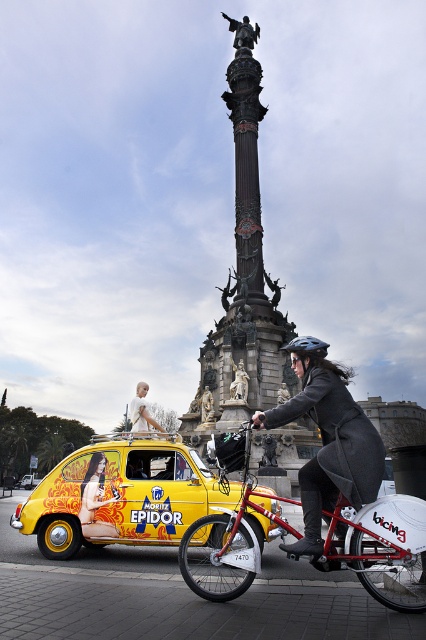
Who is positioned more to the right, dark stone column at center or black matte bicycle helmet at center?

Positioned to the right is black matte bicycle helmet at center.

Measure the distance between dark stone column at center and black matte bicycle helmet at center.

dark stone column at center is 25.63 meters from black matte bicycle helmet at center.

What do you see at coordinates (242, 280) in the screenshot? This screenshot has height=640, width=426. I see `dark stone column at center` at bounding box center [242, 280].

The height and width of the screenshot is (640, 426). Find the location of `dark stone column at center`. dark stone column at center is located at coordinates (242, 280).

Is gray wool coat at center above yellow matte vintage car at center?

Indeed, gray wool coat at center is positioned over yellow matte vintage car at center.

Consider the image. Does gray wool coat at center come behind yellow matte vintage car at center?

No, gray wool coat at center is in front of yellow matte vintage car at center.

Measure the distance between point (305, 488) and camera.

They are 67.30 meters apart.

Identify the location of gray wool coat at center. (328, 440).

At what (x,y) coordinates should I click in order to perform the action: click on yellow matte taxi at center. Please return your answer as a coordinate pair (x, y). The height and width of the screenshot is (640, 426). Looking at the image, I should click on (121, 496).